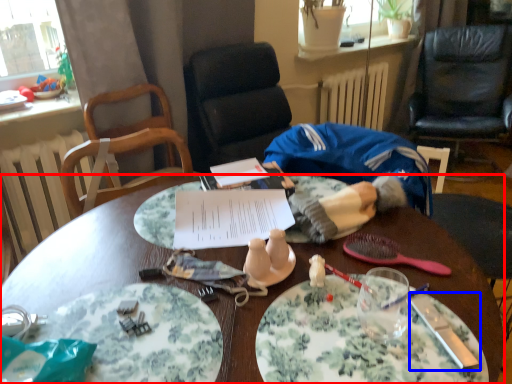
Question: Which object appears closest to the camera in this image, desk (highlighted by a red box) or knife (highlighted by a blue box)?

Choices:
 (A) desk
 (B) knife

Answer: (A)